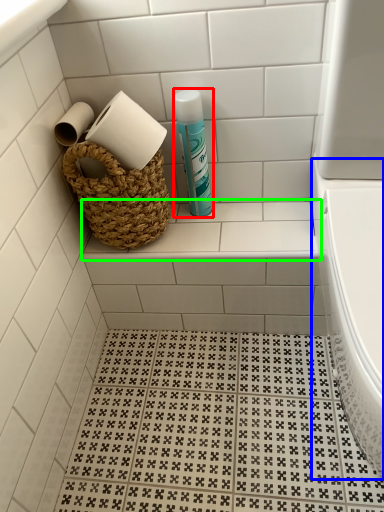
Question: Considering the real-world distances, which object is farthest from cleaning product (highlighted by a red box)? bath (highlighted by a blue box) or ledge (highlighted by a green box)?

Choices:
 (A) bath
 (B) ledge

Answer: (A)